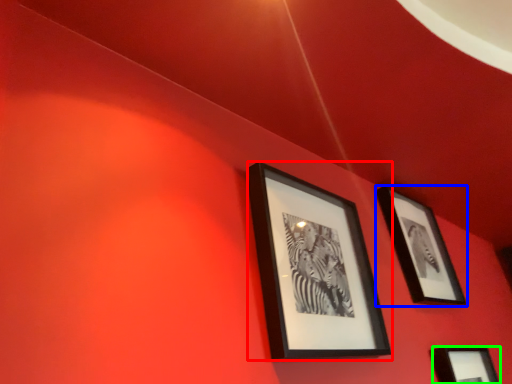
Question: Considering the real-world distances, which object is farthest from picture frame (highlighted by a red box)? picture frame (highlighted by a blue box) or picture frame (highlighted by a green box)?

Choices:
 (A) picture frame
 (B) picture frame

Answer: (B)